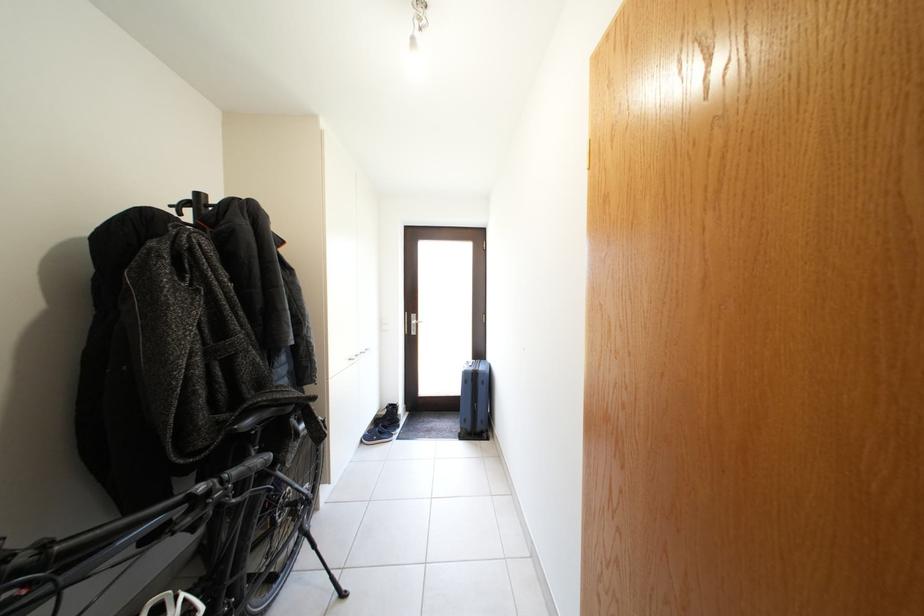
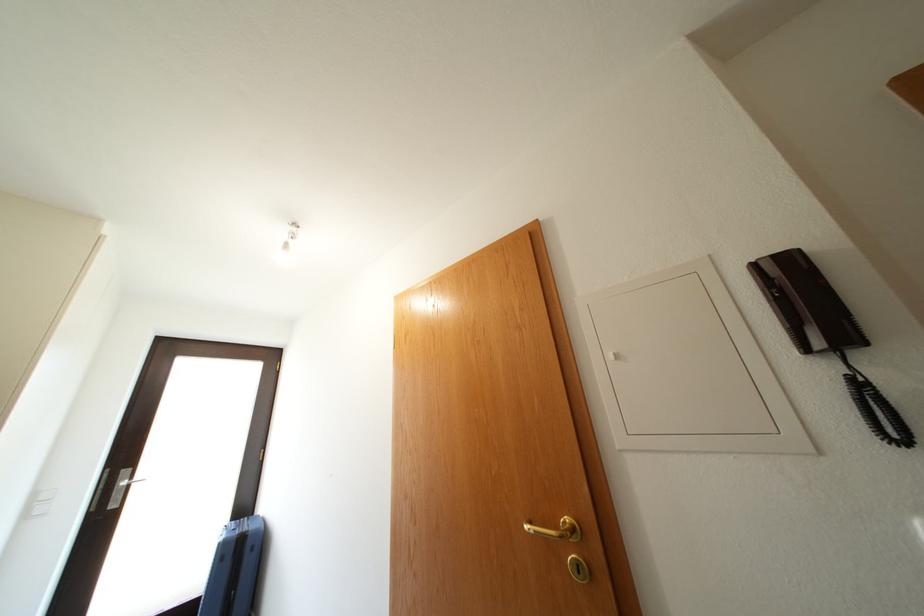
How did the camera likely rotate?

The camera's rotation is toward right-up.